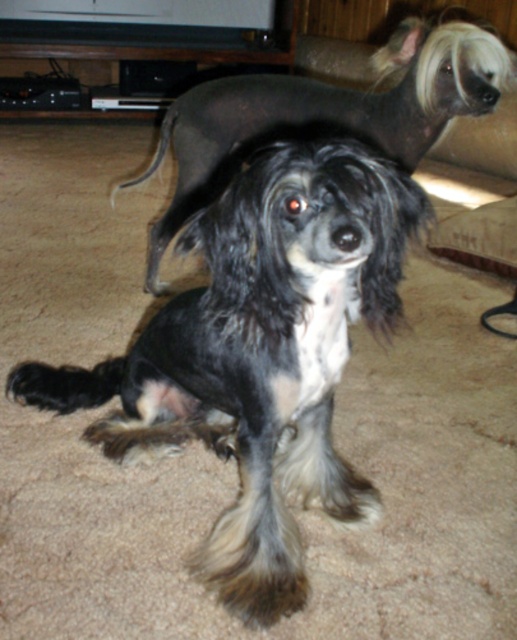
Question: Considering the relative positions of black and white fur at center and black fur tail at upper center in the image provided, where is black and white fur at center located with respect to black fur tail at upper center?

Choices:
 (A) above
 (B) below

Answer: (B)

Question: Can you confirm if black and white fur at center is positioned to the right of black silky dog at center?

Choices:
 (A) yes
 (B) no

Answer: (B)

Question: Which object appears farthest from the camera in this image?

Choices:
 (A) black and white fur at center
 (B) black fur tail at upper center
 (C) black silky dog at center

Answer: (B)

Question: Among these objects, which one is nearest to the camera?

Choices:
 (A) black fur tail at upper center
 (B) black silky dog at center

Answer: (B)

Question: Which object appears farthest from the camera in this image?

Choices:
 (A) black fur tail at upper center
 (B) black and white fur at center
 (C) black silky dog at center

Answer: (A)

Question: Is black and white fur at center to the left of black silky dog at center from the viewer's perspective?

Choices:
 (A) yes
 (B) no

Answer: (A)